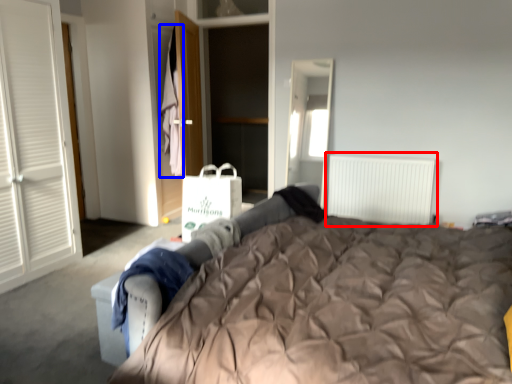
Question: Which object is closer to the camera taking this photo, radiator (highlighted by a red box) or laundry (highlighted by a blue box)?

Choices:
 (A) radiator
 (B) laundry

Answer: (A)